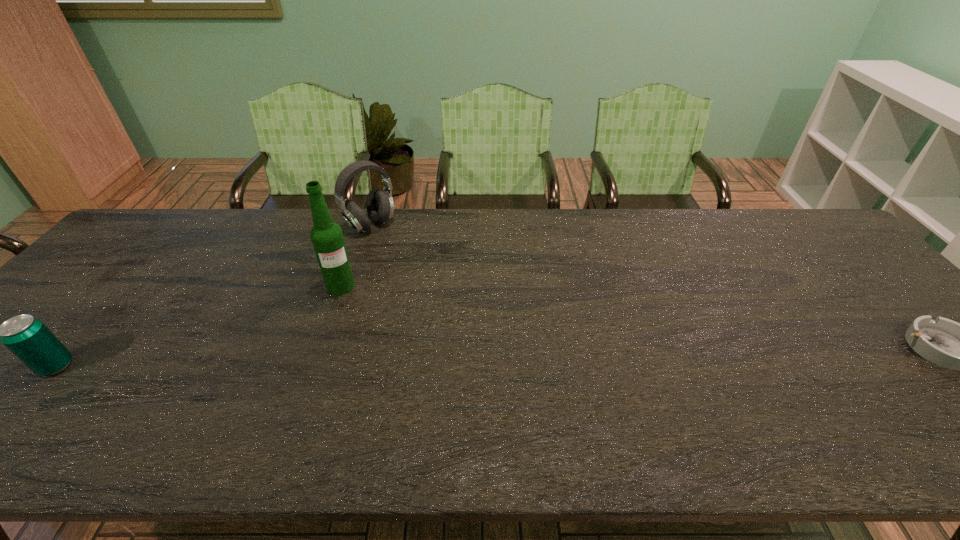
This screenshot has width=960, height=540. What are the coordinates of `free region located 0.390m on the ear cups of the farthest object` in the screenshot? It's located at coord(450,309).

I want to click on vacant region located on the ear cups of the farthest object, so click(429, 286).

Find the location of `free spot located 0.070m on the ear cups of the farthest object`. free spot located 0.070m on the ear cups of the farthest object is located at coordinates (393, 248).

Locate an element on the screen. Image resolution: width=960 pixels, height=540 pixels. object present at the far edge is located at coordinates (380, 207).

You are a GUI agent. You are given a task and a screenshot of the screen. Output one action in this format:
    pyautogui.click(x=<x>, y=<y>)
    Task: Click on the object that is at the near edge
    This screenshot has width=960, height=540.
    Given the screenshot: What is the action you would take?
    pyautogui.click(x=29, y=339)

You are a GUI agent. You are given a task and a screenshot of the screen. Output one action in this format:
    pyautogui.click(x=<x>, y=<y>)
    Task: Click on the object present at the left edge
    
    Given the screenshot: What is the action you would take?
    pyautogui.click(x=29, y=339)

I want to click on object present at the near left corner, so click(29, 339).

You are a GUI agent. You are given a task and a screenshot of the screen. Output one action in this format:
    pyautogui.click(x=<x>, y=<y>)
    Task: Click on the free region at the far edge of the desktop
    
    Given the screenshot: What is the action you would take?
    pyautogui.click(x=643, y=239)

The image size is (960, 540). Identify the location of vacant region at the near edge. (454, 409).

This screenshot has width=960, height=540. In the image, there is a desktop. Identify the location of free space at the right edge. (891, 315).